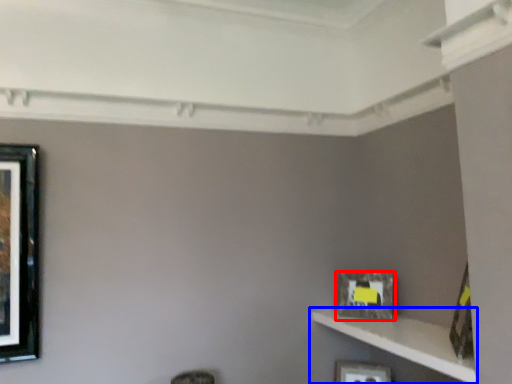
Question: Which object is further to the camera taking this photo, picture frame (highlighted by a red box) or shelf (highlighted by a blue box)?

Choices:
 (A) picture frame
 (B) shelf

Answer: (A)